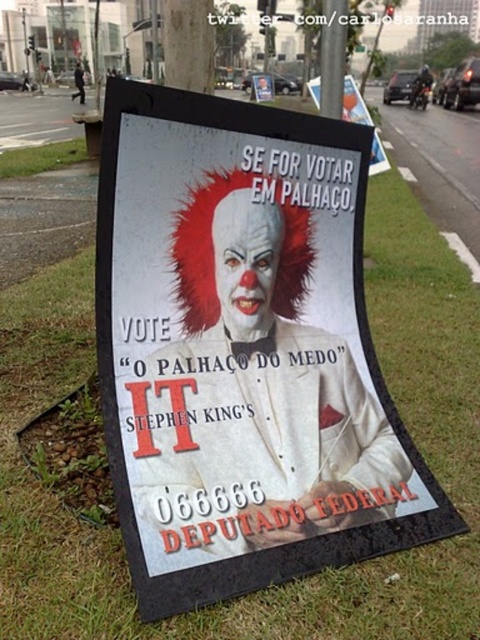
Between white paper poster at center and matte plastic poster at upper center, which one has less height?

white paper poster at center is shorter.

Can you confirm if white paper poster at center is bigger than matte plastic poster at upper center?

Actually, white paper poster at center might be smaller than matte plastic poster at upper center.

Measure the distance between point (288, 364) and camera.

Point (288, 364) is 7.13 feet away from camera.

You are a GUI agent. You are given a task and a screenshot of the screen. Output one action in this format:
    pyautogui.click(x=<x>, y=<y>)
    Task: Click on the white paper poster at center
    
    Given the screenshot: What is the action you would take?
    pyautogui.click(x=242, y=352)

Between point (308, 381) and point (321, 42), which one is positioned in front?

Point (308, 381) is more forward.

This screenshot has height=640, width=480. I want to click on white paper poster at center, so click(242, 352).

Is metallic pole at upper center behind matte plastic poster at upper center?

Yes, it is.

Who is positioned more to the left, metallic pole at upper center or matte plastic poster at upper center?

metallic pole at upper center is more to the left.

The image size is (480, 640). In order to click on metallic pole at upper center in this screenshot , I will do `click(333, 56)`.